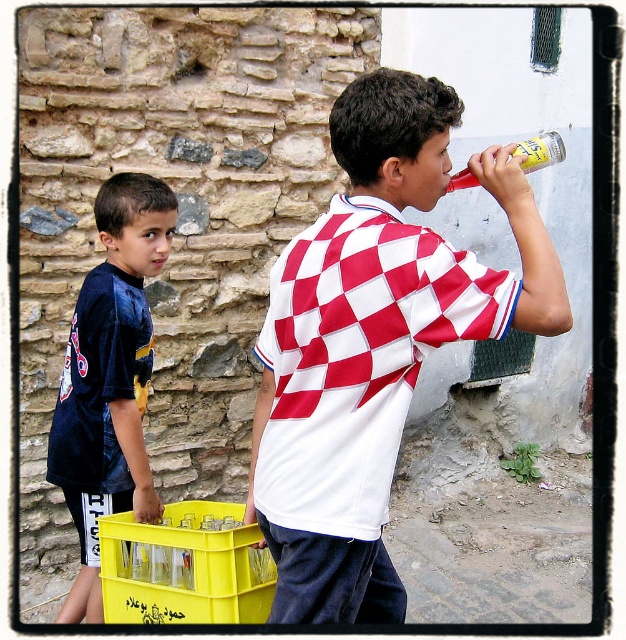
Does white checkered shirt at center appear on the right side of dark blue jersey at left?

Yes, white checkered shirt at center is to the right of dark blue jersey at left.

Describe the element at coordinates (374, 340) in the screenshot. I see `white checkered shirt at center` at that location.

Is point (264, 388) farther from viewer compared to point (83, 595)?

That is False.

You are a GUI agent. You are given a task and a screenshot of the screen. Output one action in this format:
    pyautogui.click(x=<x>, y=<y>)
    Task: Click on the white checkered shirt at center
    
    Given the screenshot: What is the action you would take?
    pyautogui.click(x=374, y=340)

Who is shorter, dark blue jersey at left or translucent plastic bottle at upper right?

With less height is translucent plastic bottle at upper right.

Is dark blue jersey at left shorter than translucent plastic bottle at upper right?

Incorrect, dark blue jersey at left's height does not fall short of translucent plastic bottle at upper right's.

Is point (126, 316) closer to viewer compared to point (538, 148)?

No, (126, 316) is further to viewer.

Locate an element on the screen. This screenshot has height=640, width=626. dark blue jersey at left is located at coordinates (110, 378).

This screenshot has width=626, height=640. What do you see at coordinates (374, 340) in the screenshot?
I see `white checkered shirt at center` at bounding box center [374, 340].

Does point (295, 346) come farther from viewer compared to point (553, 138)?

No, it is not.

This screenshot has width=626, height=640. In order to click on white checkered shirt at center in this screenshot , I will do `click(374, 340)`.